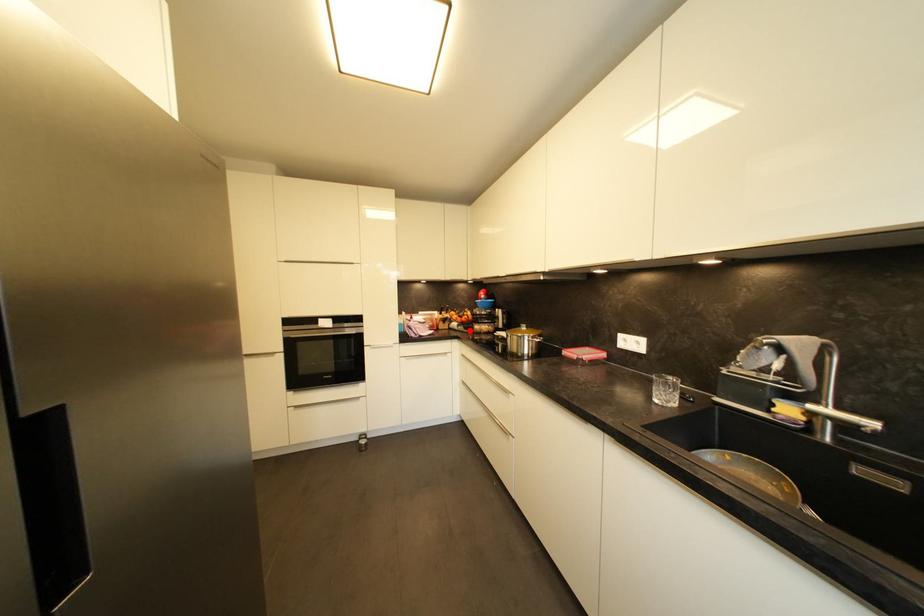
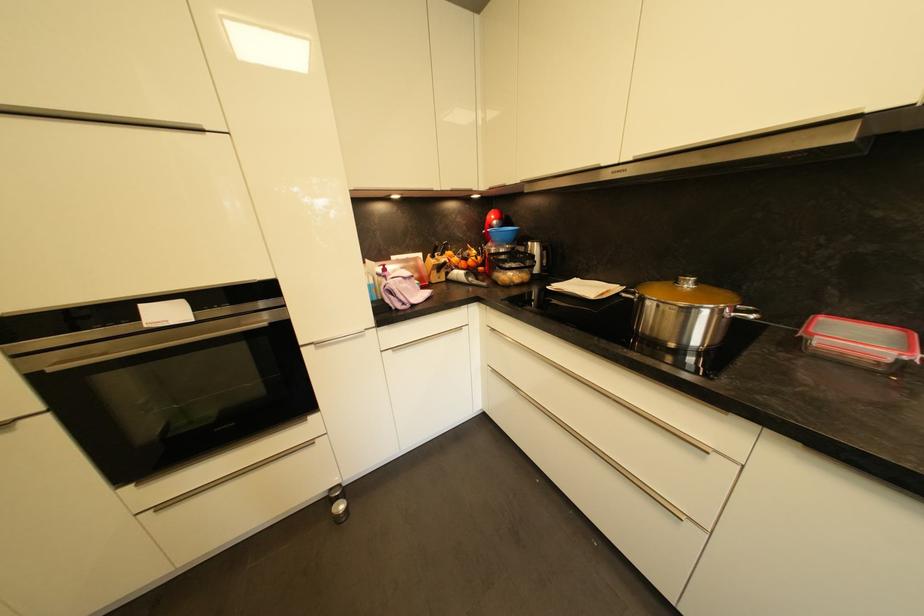
In the second image, find the point that corresponds to the highlighted location in the first image.

(481, 281)